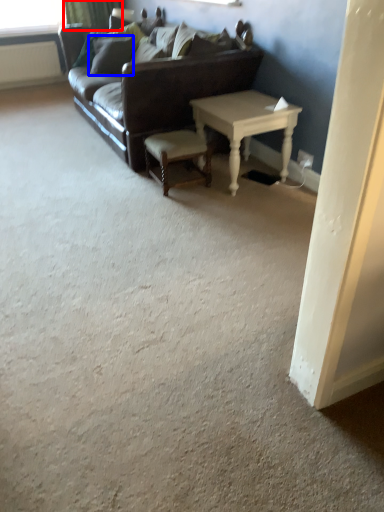
Question: Which object is further to the camera taking this photo, curtain (highlighted by a red box) or pillow (highlighted by a blue box)?

Choices:
 (A) curtain
 (B) pillow

Answer: (A)